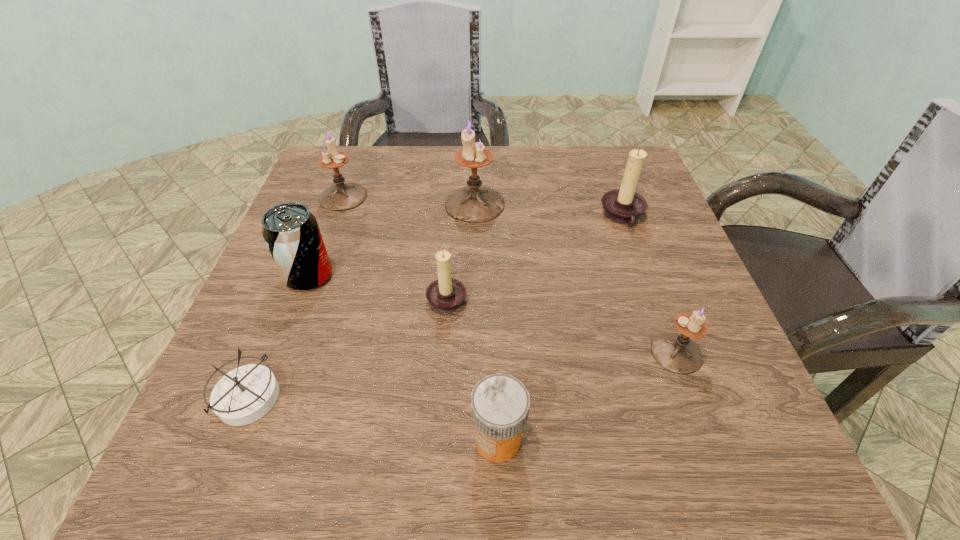
Where is `object that can be found as the seventh closest to the compass`? The width and height of the screenshot is (960, 540). object that can be found as the seventh closest to the compass is located at coordinates (624, 206).

I want to click on candle holder that is the closest to the second purple candle holder from left to right, so [446, 294].

Locate an element on the screen. Image resolution: width=960 pixels, height=540 pixels. candle holder object that ranks as the fourth closest to the orange medicine is located at coordinates (624, 206).

Find the location of a particular element. purple candle holder identified as the third closest to the right brown candle holder is located at coordinates (341, 196).

Find the location of a particular element. This screenshot has width=960, height=540. purple candle holder that can be found as the third closest to the right brown candle holder is located at coordinates (341, 196).